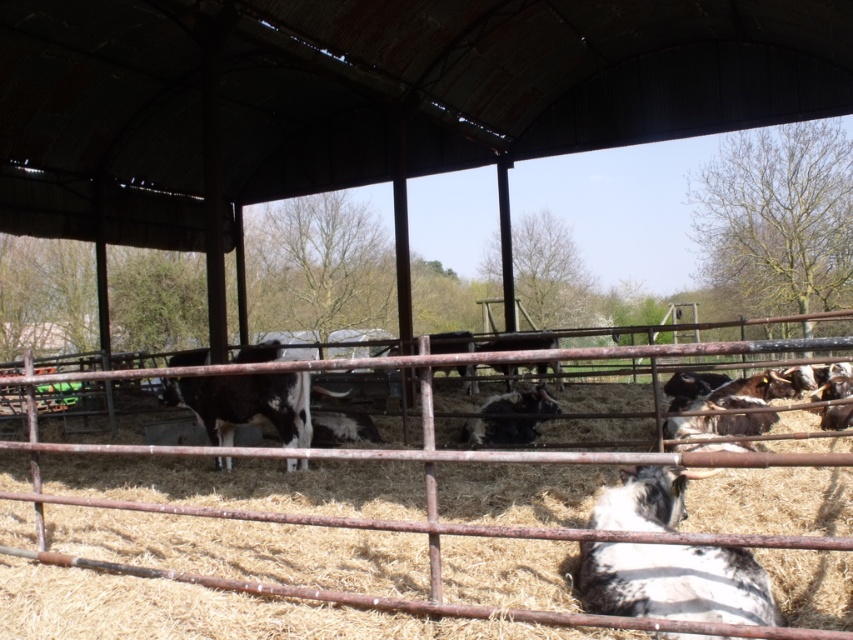
You are a farmer checking the barn. You notice the rusty metal fence at center and the white speckled fur at center. Which object is positioned higher in the image?

The white speckled fur at center is positioned higher than the rusty metal fence at center in the image.

You are standing inside the barn and want to touch the white speckled fur at center and the black and white cow at center. Which one can you reach first without moving your position?

The white speckled fur at center is closer to the viewer than the black and white cow at center, so you can reach it first without moving.

You are a farmer checking the barn. You need to place a 2 meter long ladder between the rusty metal fence at center and the white speckled fur at center. Will the ladder fit without overlapping either object?

The rusty metal fence at center and white speckled fur at center are 2.03 meters apart. Since the ladder is 2 meters long, it will fit with a small gap of 3 centimeters between them.